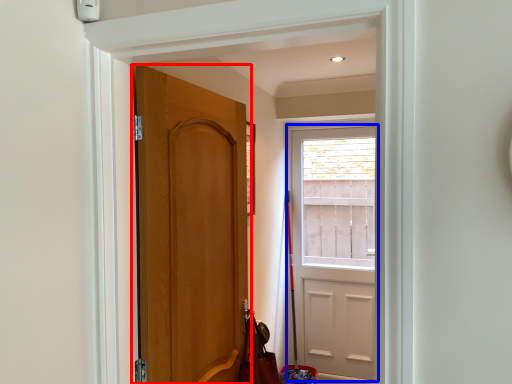
Question: Which point is closer to the camera, door (highlighted by a red box) or door (highlighted by a blue box)?

Choices:
 (A) door
 (B) door

Answer: (A)